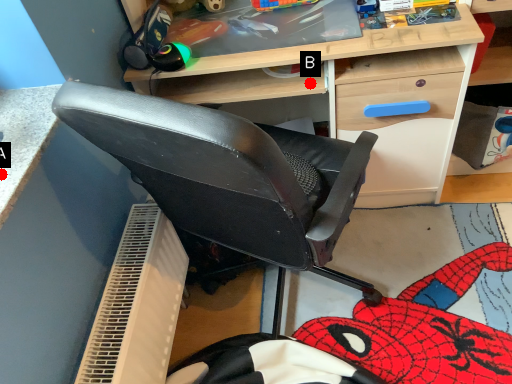
Question: Two points are circled on the image, labeled by A and B beside each circle. Which of the following is the closest to the observer?

Choices:
 (A) A is closer
 (B) B is closer

Answer: (A)